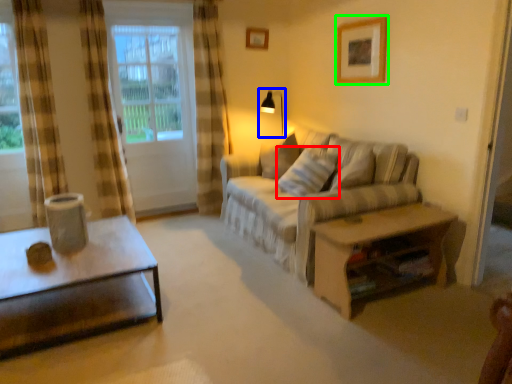
Question: Which object is positioned farthest from pillow (highlighted by a red box)? Select from table lamp (highlighted by a blue box) and picture frame (highlighted by a green box).

Choices:
 (A) table lamp
 (B) picture frame

Answer: (A)